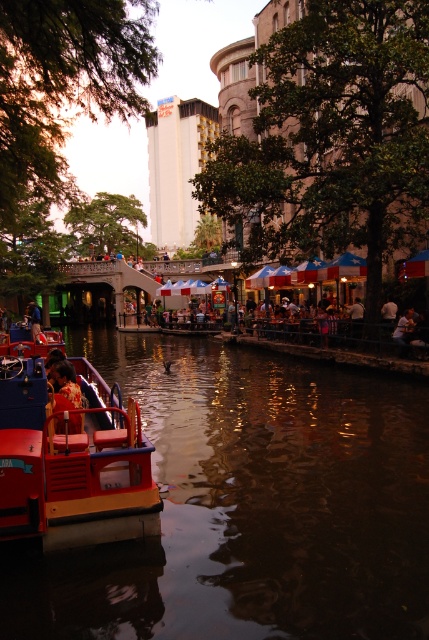
Question: Does dark reflective water at lower center have a greater width compared to yellow fabric shirt at lower left?

Choices:
 (A) no
 (B) yes

Answer: (B)

Question: Which of the following is the closest to the observer?

Choices:
 (A) (27, 308)
 (B) (278, 493)
 (C) (141, 490)
 (D) (71, 388)

Answer: (C)

Question: Which of the following is the farthest from the observer?

Choices:
 (A) (27, 307)
 (B) (75, 388)
 (C) (0, 534)
 (D) (199, 385)

Answer: (A)

Question: Can you confirm if red plastic boat at lower left is positioned to the right of yellow fabric shirt at lower left?

Choices:
 (A) no
 (B) yes

Answer: (B)

Question: Which of the following is the farthest from the observer?

Choices:
 (A) blue denim jacket at lower left
 (B) red plastic boat at lower left
 (C) yellow fabric shirt at lower left

Answer: (A)

Question: Is the position of dark reflective water at lower center less distant than that of yellow fabric shirt at lower left?

Choices:
 (A) yes
 (B) no

Answer: (A)